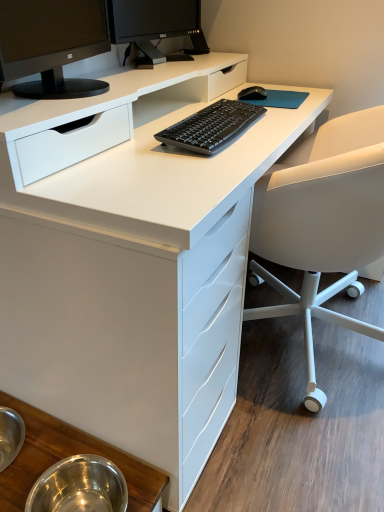
Question: Can you confirm if matte black monitor at upper left, the 1th computer monitor positioned from the front, is bigger than black glossy monitor at upper center, marked as the 2th computer monitor in a front-to-back arrangement?

Choices:
 (A) yes
 (B) no

Answer: (A)

Question: Considering the relative positions of matte black monitor at upper left, the 2th computer monitor from the back, and black glossy monitor at upper center, marked as the 2th computer monitor in a front-to-back arrangement, in the image provided, is matte black monitor at upper left, the 2th computer monitor from the back, in front of black glossy monitor at upper center, marked as the 2th computer monitor in a front-to-back arrangement,?

Choices:
 (A) no
 (B) yes

Answer: (B)

Question: Is matte black monitor at upper left, the 2th computer monitor from the back, wider than black glossy monitor at upper center, marked as the 2th computer monitor in a front-to-back arrangement?

Choices:
 (A) yes
 (B) no

Answer: (A)

Question: From a real-world perspective, is matte black monitor at upper left, the 1th computer monitor positioned from the front, positioned under black glossy monitor at upper center, marked as the 2th computer monitor in a front-to-back arrangement, based on gravity?

Choices:
 (A) yes
 (B) no

Answer: (A)

Question: Can you see matte black monitor at upper left, the 2th computer monitor from the back, touching black glossy monitor at upper center, marked as the 2th computer monitor in a front-to-back arrangement?

Choices:
 (A) yes
 (B) no

Answer: (B)

Question: Is the position of matte black monitor at upper left, the 1th computer monitor positioned from the front, more distant than that of black glossy monitor at upper center, marked as the 2th computer monitor in a front-to-back arrangement?

Choices:
 (A) no
 (B) yes

Answer: (A)

Question: Is metallic stainless steel bowls at lower left located within matte black monitor at upper left, the 1th computer monitor positioned from the front?

Choices:
 (A) no
 (B) yes

Answer: (A)

Question: Is matte black monitor at upper left, the 1th computer monitor positioned from the front, wider than metallic stainless steel bowls at lower left?

Choices:
 (A) yes
 (B) no

Answer: (A)

Question: Is the position of matte black monitor at upper left, the 1th computer monitor positioned from the front, more distant than that of metallic stainless steel bowls at lower left?

Choices:
 (A) yes
 (B) no

Answer: (B)

Question: Does matte black monitor at upper left, the 2th computer monitor from the back, appear on the left side of metallic stainless steel bowls at lower left?

Choices:
 (A) no
 (B) yes

Answer: (A)

Question: From the image's perspective, would you say matte black monitor at upper left, the 1th computer monitor positioned from the front, is shown under metallic stainless steel bowls at lower left?

Choices:
 (A) no
 (B) yes

Answer: (A)

Question: From a real-world perspective, is white matte office chair at right on black glossy monitor at upper center, which ranks as the 1th computer monitor in back-to-front order?

Choices:
 (A) yes
 (B) no

Answer: (B)